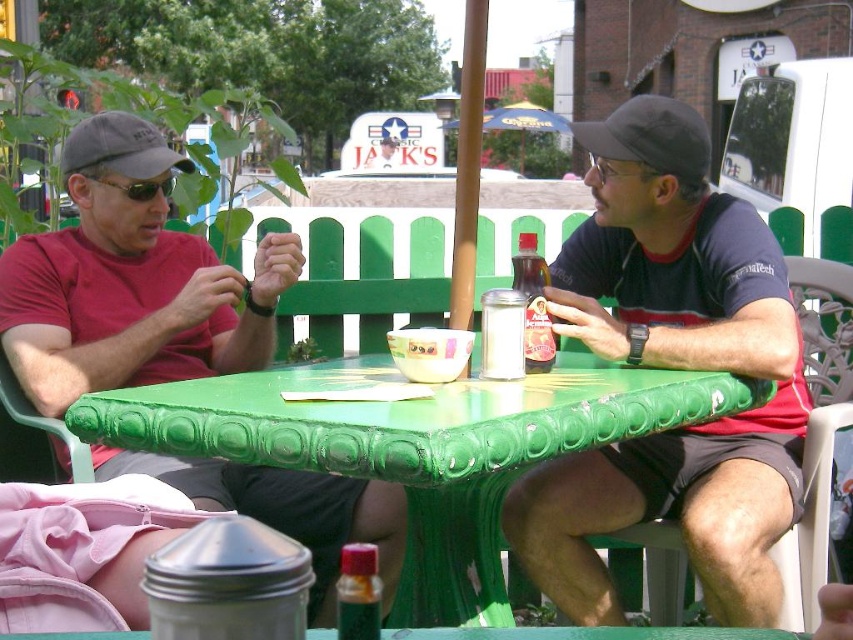
Question: Is matte red shirt at left to the left of translucent plastic bottle at table center from the viewer's perspective?

Choices:
 (A) yes
 (B) no

Answer: (A)

Question: Does matte black shirt at center have a larger size compared to green painted plastic table at center?

Choices:
 (A) yes
 (B) no

Answer: (B)

Question: Which of the following is the closest to the observer?

Choices:
 (A) translucent plastic bottle at center
 (B) matte gray baseball cap at left

Answer: (A)

Question: Can you confirm if matte gray baseball cap at left is smaller than yellow fabric umbrella at center?

Choices:
 (A) yes
 (B) no

Answer: (A)

Question: Estimate the real-world distances between objects in this image. Which object is closer to the black fabric baseball cap at upper center?

Choices:
 (A) yellow fabric umbrella at center
 (B) translucent plastic bottle at center
 (C) green painted plastic table at center
 (D) matte red shirt at left

Answer: (C)

Question: Which object is the farthest from the matte gray baseball cap at left?

Choices:
 (A) translucent plastic bottle at center
 (B) matte red shirt at left

Answer: (A)